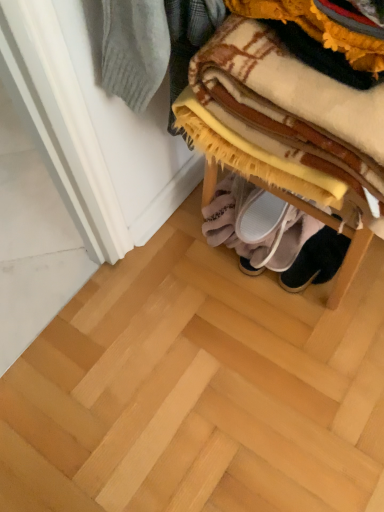
Where is `vacant position to the left of black suede shoes at lower center, which ranks as the first footwear in right-to-left order`? vacant position to the left of black suede shoes at lower center, which ranks as the first footwear in right-to-left order is located at coordinates (241, 286).